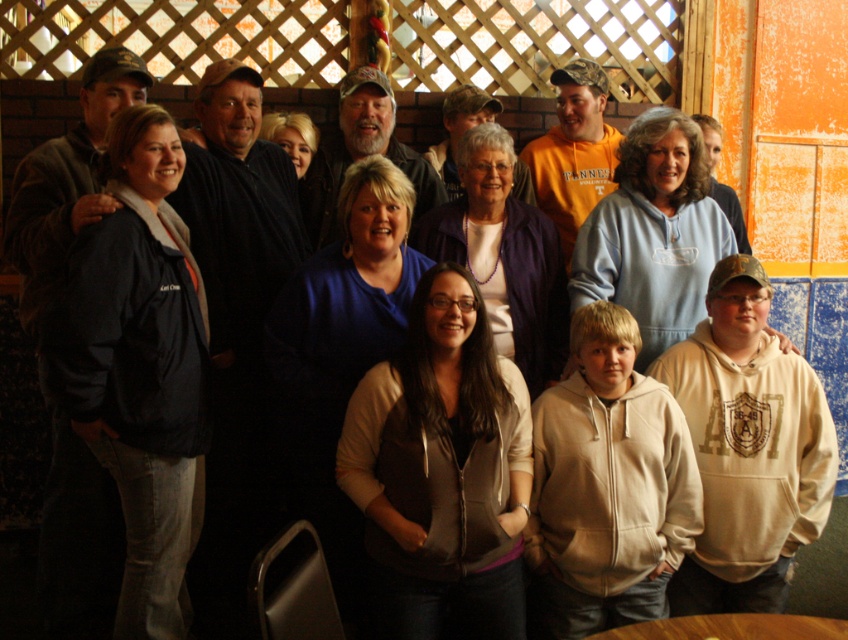
You are taking a photo of the group and want to focus on the point at the bottom center of the image. Which of the two points, point [104,339] or point [679,122], is closer to the camera and thus in focus?

Point [104,339] is closer to the camera than point [679,122], so it will be in focus.

You are a photographer standing in front of the group. You want to adjust the camera to capture both the dark blue jacket at left and the purple fabric at center in the same frame. The camera has a maximum zoom range of 10 meters. Can you fit both objects in the frame without moving closer?

The dark blue jacket at left and purple fabric at center are 10.66 meters apart. Since the camera can only zoom up to 10 meters, you cannot fit both objects in the frame without moving closer.